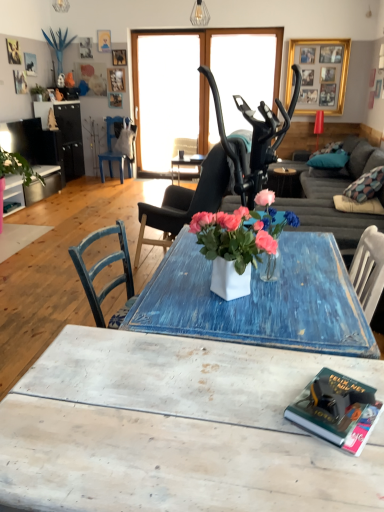
Question: Does blue fabric pillow at right turn towards matte black chair at center, which appears as the first chair when viewed from the right?

Choices:
 (A) no
 (B) yes

Answer: (B)

Question: From the image's perspective, does blue fabric pillow at right appear higher than matte black chair at center, the 2th chair viewed from the top?

Choices:
 (A) yes
 (B) no

Answer: (A)

Question: Is blue fabric pillow at right looking in the opposite direction of matte black chair at center, which is the second chair from back to front?

Choices:
 (A) yes
 (B) no

Answer: (B)

Question: Are blue fabric pillow at right and matte black chair at center, marked as the second chair in a left-to-right arrangement, beside each other?

Choices:
 (A) yes
 (B) no

Answer: (B)

Question: Can matte black chair at center, which is the 1th chair from bottom to top, be found inside blue fabric pillow at right?

Choices:
 (A) yes
 (B) no

Answer: (B)

Question: From a real-world perspective, is gold-framed collage at upper center physically located above or below hardcover book at lower right?

Choices:
 (A) above
 (B) below

Answer: (A)

Question: Considering the positions of gold-framed collage at upper center and hardcover book at lower right in the image, is gold-framed collage at upper center bigger or smaller than hardcover book at lower right?

Choices:
 (A) big
 (B) small

Answer: (A)

Question: From the image's perspective, is gold-framed collage at upper center positioned above or below hardcover book at lower right?

Choices:
 (A) below
 (B) above

Answer: (B)

Question: From their relative heights in the image, would you say gold-framed collage at upper center is taller or shorter than hardcover book at lower right?

Choices:
 (A) tall
 (B) short

Answer: (A)

Question: From the image's perspective, is white distressed wood coffee table at lower center above or below blue painted wood chair at left, placed as the 1th chair when sorted from left to right?

Choices:
 (A) above
 (B) below

Answer: (B)

Question: In terms of width, does white distressed wood coffee table at lower center look wider or thinner when compared to blue painted wood chair at left, the 1th chair viewed from the top?

Choices:
 (A) wide
 (B) thin

Answer: (A)

Question: Is white distressed wood coffee table at lower center taller or shorter than blue painted wood chair at left, placed as the second chair when sorted from bottom to top?

Choices:
 (A) short
 (B) tall

Answer: (A)

Question: From a real-world perspective, is white distressed wood coffee table at lower center above or below blue painted wood chair at left, positioned as the second chair in right-to-left order?

Choices:
 (A) above
 (B) below

Answer: (B)

Question: In terms of height, does matte black chair at center, which appears as the first chair when viewed from the right, look taller or shorter compared to gold-framed collage at upper center?

Choices:
 (A) short
 (B) tall

Answer: (B)

Question: Visually, is matte black chair at center, which is the 1th chair from bottom to top, positioned to the left or to the right of gold-framed collage at upper center?

Choices:
 (A) right
 (B) left

Answer: (B)